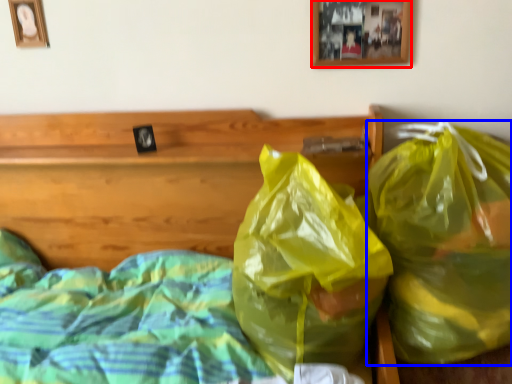
Question: Which point is closer to the camera, picture frame (highlighted by a red box) or plastic bag (highlighted by a blue box)?

Choices:
 (A) picture frame
 (B) plastic bag

Answer: (B)